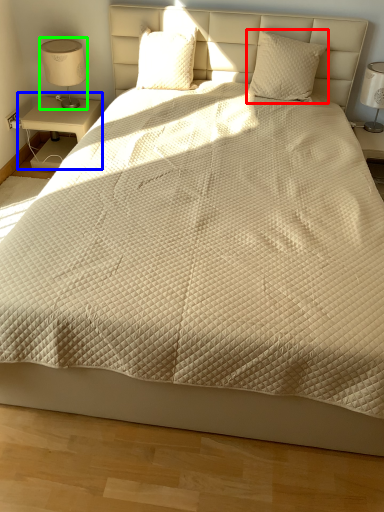
Question: Which object is positioned closest to pillow (highlighted by a red box)? Select from nightstand (highlighted by a blue box) and table lamp (highlighted by a green box).

Choices:
 (A) nightstand
 (B) table lamp

Answer: (A)